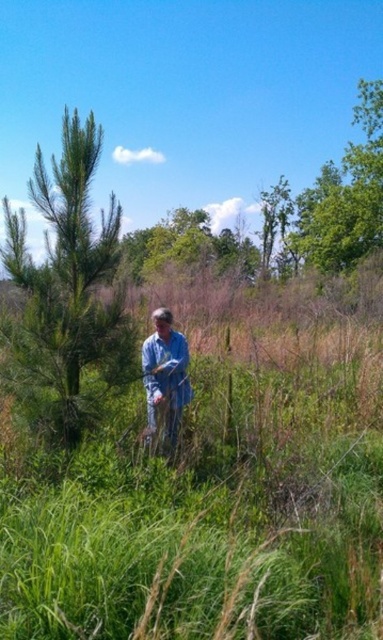
Question: Does green needle-like tree at left appear under blue denim shirt at center?

Choices:
 (A) no
 (B) yes

Answer: (A)

Question: In this image, where is green needle-like tree at left located relative to blue denim shirt at center?

Choices:
 (A) left
 (B) right

Answer: (A)

Question: Can you confirm if green needle-like tree at left is positioned to the left of blue denim shirt at center?

Choices:
 (A) no
 (B) yes

Answer: (B)

Question: Which point is closer to the camera?

Choices:
 (A) (75, 118)
 (B) (163, 387)

Answer: (A)